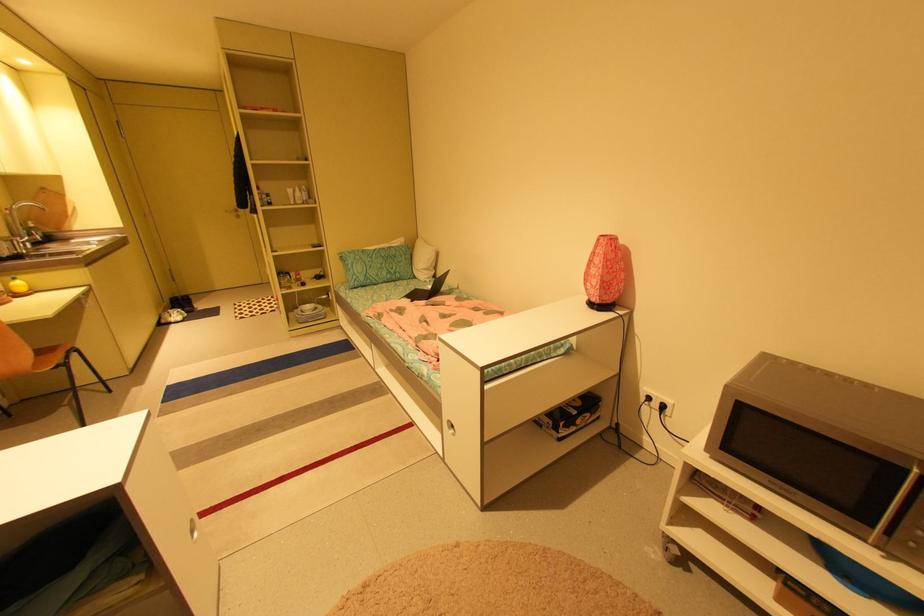
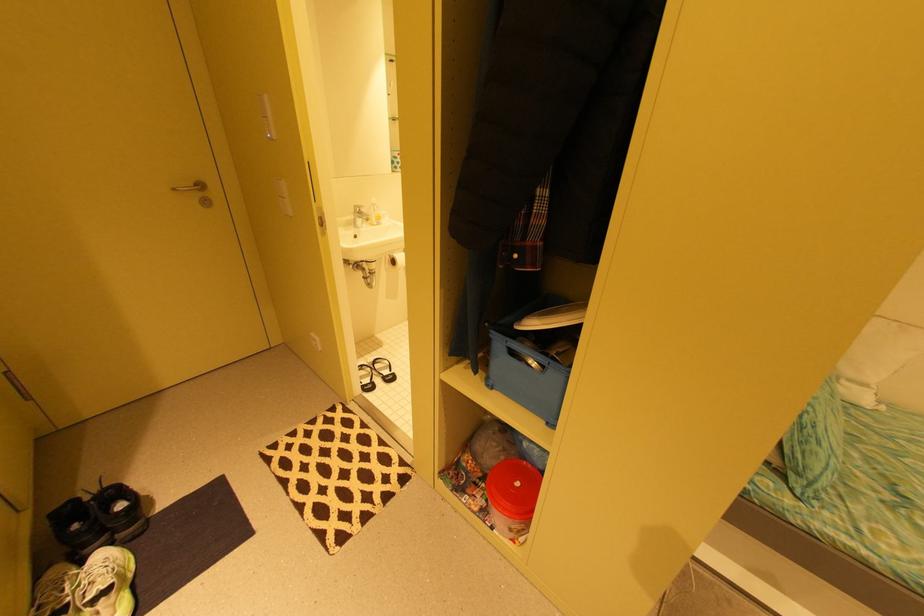
What movement of the cameraman would produce the second image?

The cameraman moved toward left, forward.